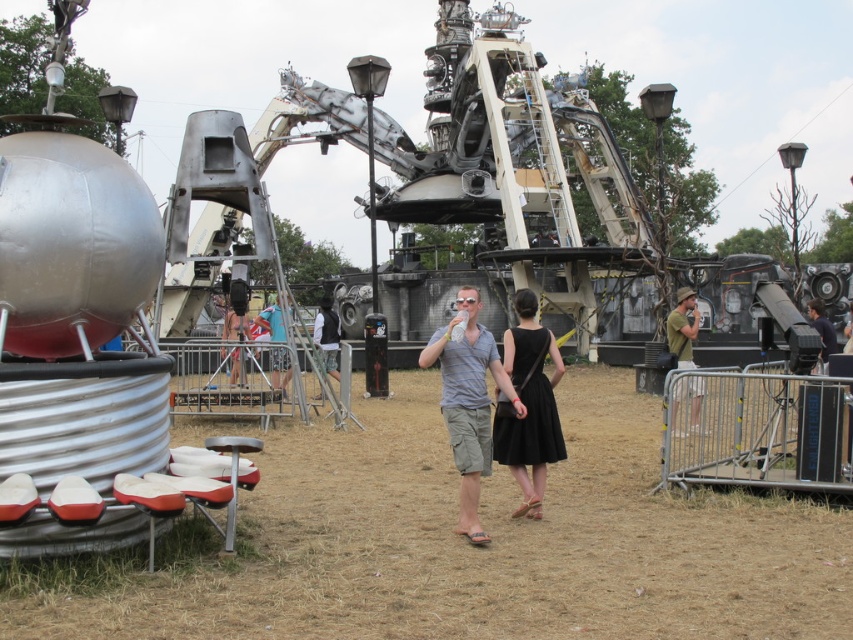
You are a photographer trying to capture the matte gray shirt at center and the black satin dress at center in the same frame. The camera you have can only focus on objects within a 4.5 feet range. Will both subjects be in focus?

The matte gray shirt at center and the black satin dress at center are 5.06 feet apart from each other, which exceeds the camera focus range of 4.5 feet. Therefore, both subjects cannot be in focus simultaneously.

You are an event photographer at the festival. You want to capture a photo of the matte gray shirt at center and the black satin dress at center such that both are clearly visible. Based on their positions, which one should you focus on first to ensure proper depth of field?

The matte gray shirt at center should be focused on first because it is positioned under the black satin dress at center, meaning it is closer to the camera. By focusing on the closer object, the depth of field will naturally include the farther one as well.

You are standing at the festival and want to take a photo of both the man and the woman walking in the foreground and the mechanical sculpture in the background. Which of the two points, point (460, 419) or point (672, 330), is closer to you when framing your shot?

Point (460, 419) is closer to the camera than point (672, 330), so it will appear nearer in your photo.